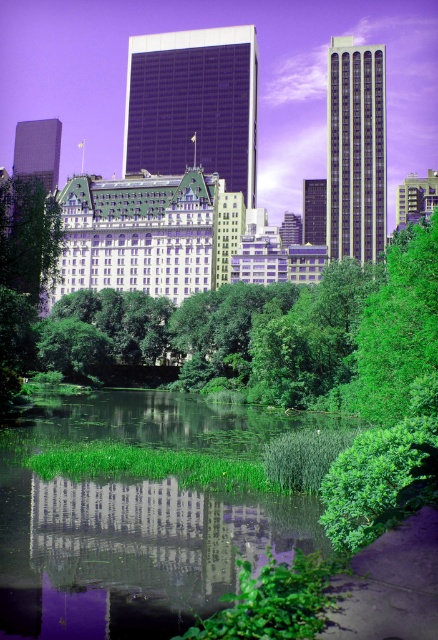
Between point (126, 161) and point (373, 64), which one is positioned behind?

The point (126, 161) is more distant.

Find the location of a particular element. purple glass skyscraper at center is located at coordinates (194, 104).

Between purple glass skyscraper at center and matte green building at upper center, which one has more height?

purple glass skyscraper at center

Between point (176, 102) and point (434, 184), which one is positioned behind?

The point (176, 102) is behind.

This screenshot has height=640, width=438. Find the location of `purple glass skyscraper at center`. purple glass skyscraper at center is located at coordinates (194, 104).

Can you confirm if matte glass skyscraper at upper right is shorter than green leafy tree at right?

Incorrect, matte glass skyscraper at upper right's height does not fall short of green leafy tree at right's.

Which is in front, point (336, 132) or point (371, 294)?

Positioned in front is point (371, 294).

Is point (373, 125) closer to viewer compared to point (346, 390)?

No, (373, 125) is behind (346, 390).

At what (x,y) coordinates should I click in order to perform the action: click on matte glass skyscraper at upper right. Please return your answer as a coordinate pair (x, y). This screenshot has height=640, width=438. Looking at the image, I should click on (356, 150).